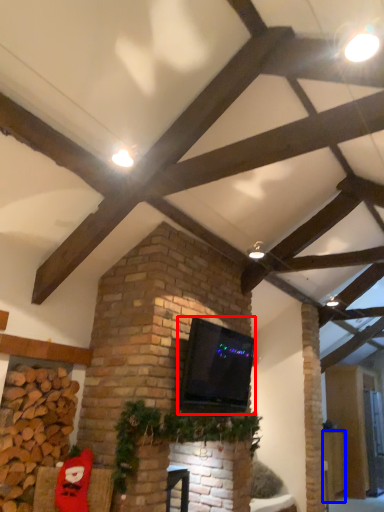
Question: Which point is closer to the camera, wide (highlighted by a red box) or furniture (highlighted by a blue box)?

Choices:
 (A) wide
 (B) furniture

Answer: (A)